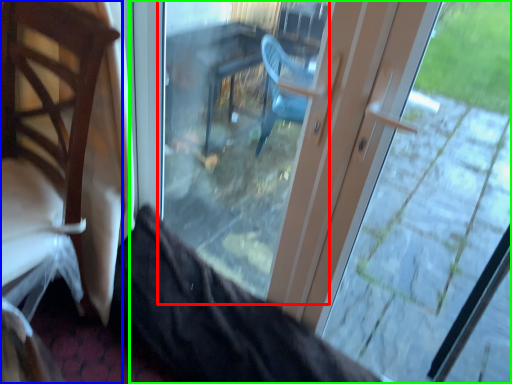
Question: Considering the real-world distances, which object is closest to glass door (highlighted by a red box)? chair (highlighted by a blue box) or door (highlighted by a green box).

Choices:
 (A) chair
 (B) door

Answer: (B)